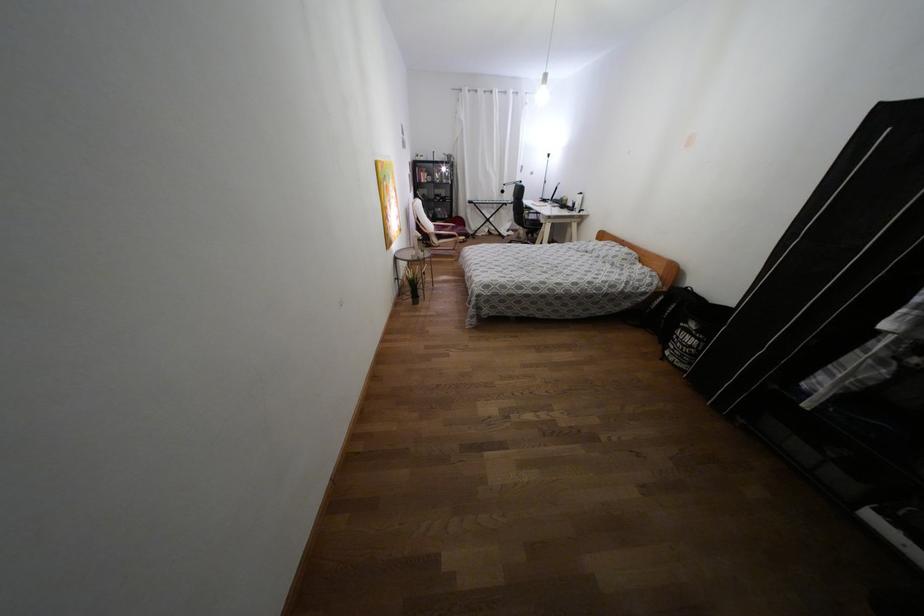
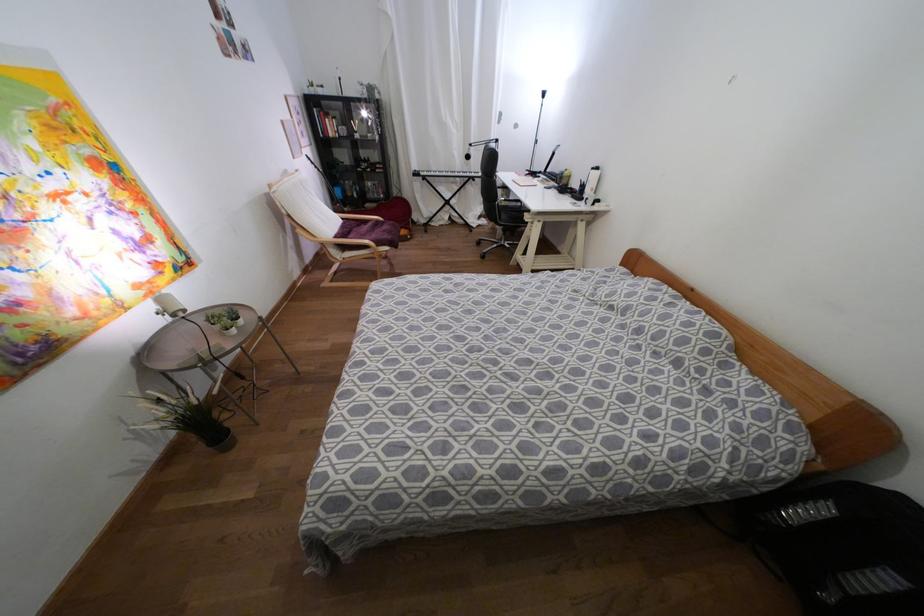
In a continuous first-person perspective shot, in which direction is the camera moving?

The movement direction of the cameraman is right, forward.